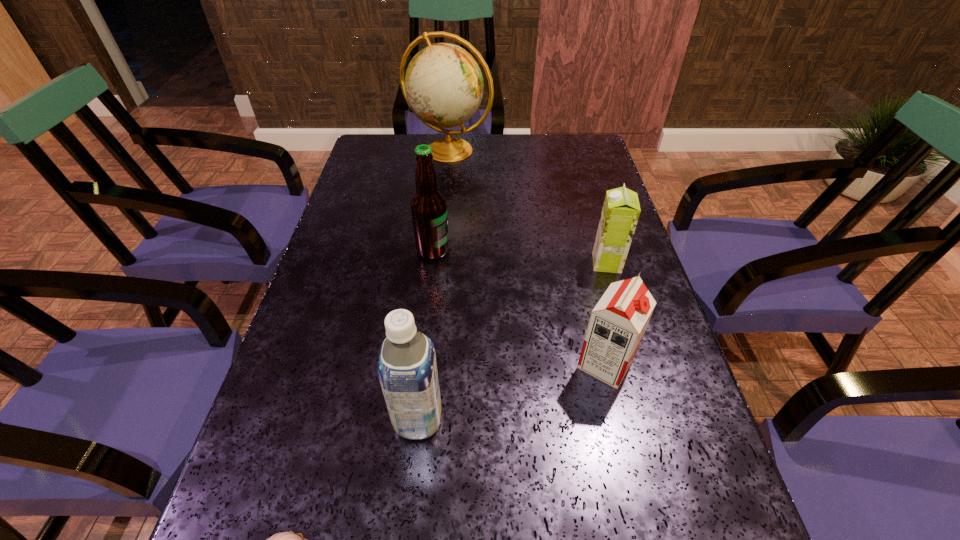
The height and width of the screenshot is (540, 960). I want to click on the farthest object, so click(x=443, y=86).

Where is `globe`? globe is located at coordinates (443, 86).

Find the location of a particular element. beer bottle is located at coordinates (428, 205).

The width and height of the screenshot is (960, 540). Find the location of `the second nearest object`. the second nearest object is located at coordinates (407, 370).

Locate an element on the screen. the tallest soya milk is located at coordinates (407, 370).

Where is `the second farthest soya milk`? Image resolution: width=960 pixels, height=540 pixels. the second farthest soya milk is located at coordinates (617, 324).

Image resolution: width=960 pixels, height=540 pixels. In order to click on the farthest soya milk in this screenshot , I will do `click(621, 209)`.

At what (x,y) coordinates should I click in order to perform the action: click on free space located on the front of the globe. Please return your answer as a coordinate pair (x, y). The height and width of the screenshot is (540, 960). Looking at the image, I should click on (445, 189).

This screenshot has height=540, width=960. Find the location of `vacant space situated 0.130m on the label of the beer bottle`. vacant space situated 0.130m on the label of the beer bottle is located at coordinates (501, 250).

Find the location of a particular element. free space located on the label of the leftmost soya milk is located at coordinates (613, 419).